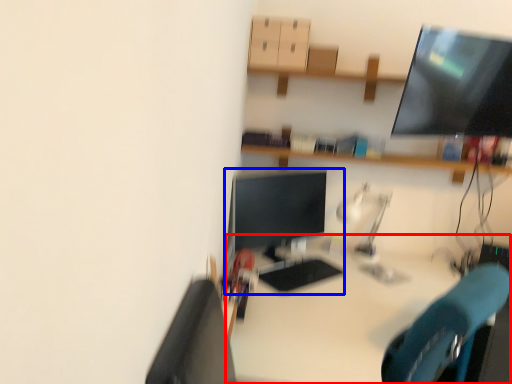
Question: Which object is further to the camera taking this photo, desk (highlighted by a red box) or desktop computer (highlighted by a blue box)?

Choices:
 (A) desk
 (B) desktop computer

Answer: (B)